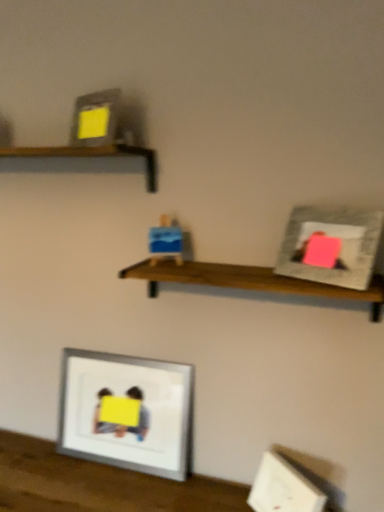
Describe the element at coordinates (166, 240) in the screenshot. I see `blue cardboard box at center` at that location.

Find the location of `wooden shelf at upper left, which appears as the 1th shelf when viewed from the left`. wooden shelf at upper left, which appears as the 1th shelf when viewed from the left is located at coordinates (91, 156).

This screenshot has width=384, height=512. What do you see at coordinates (331, 246) in the screenshot?
I see `matte gray picture frame at upper right, the 2th picture frame in the bottom-to-top sequence` at bounding box center [331, 246].

This screenshot has width=384, height=512. What do you see at coordinates (249, 281) in the screenshot?
I see `wooden shelf at center, which is the 2th shelf in top-to-bottom order` at bounding box center [249, 281].

At what (x,y) coordinates should I click in order to perform the action: click on wooden shelf at center, the first shelf positioned from the bottom. Please return your answer as a coordinate pair (x, y). Looking at the image, I should click on (249, 281).

Find the location of `blue cardboard box at center`. blue cardboard box at center is located at coordinates (166, 240).

Is wooden shelf at upper left, the first shelf viewed from the top, shorter than matte gray picture frame at upper right, the 2th picture frame when ordered from back to front?

Yes, wooden shelf at upper left, the first shelf viewed from the top, is shorter than matte gray picture frame at upper right, the 2th picture frame when ordered from back to front.

Can you confirm if wooden shelf at upper left, which appears as the 1th shelf when viewed from the left, is thinner than matte gray picture frame at upper right, the 2th picture frame in the bottom-to-top sequence?

In fact, wooden shelf at upper left, which appears as the 1th shelf when viewed from the left, might be wider than matte gray picture frame at upper right, the 2th picture frame in the bottom-to-top sequence.

Is wooden shelf at upper left, the first shelf viewed from the top, completely or partially outside of matte gray picture frame at upper right, placed as the 2th picture frame when sorted from left to right?

Yes, wooden shelf at upper left, the first shelf viewed from the top, is located beyond the bounds of matte gray picture frame at upper right, placed as the 2th picture frame when sorted from left to right.

Image resolution: width=384 pixels, height=512 pixels. I want to click on shelf that is on the right side of blue cardboard box at center, so click(249, 281).

Is wooden shelf at center, which is counted as the first shelf, starting from the right, wider or thinner than blue cardboard box at center?

Considering their sizes, wooden shelf at center, which is counted as the first shelf, starting from the right, looks broader than blue cardboard box at center.

Is blue cardboard box at center at the back of wooden shelf at center, which is counted as the first shelf, starting from the right?

No, blue cardboard box at center is not at the back of wooden shelf at center, which is counted as the first shelf, starting from the right.

Is wooden shelf at center, which is the 2th shelf in left-to-right order, not close to blue cardboard box at center?

wooden shelf at center, which is the 2th shelf in left-to-right order, is near blue cardboard box at center, not far away.

Can you tell me how much matte gray picture frame at upper right, placed as the 2th picture frame when sorted from left to right, and wooden shelf at upper left, arranged as the second shelf when ordered from the bottom, differ in facing direction?

28.3 degrees separate the facing orientations of matte gray picture frame at upper right, placed as the 2th picture frame when sorted from left to right, and wooden shelf at upper left, arranged as the second shelf when ordered from the bottom.

Considering the sizes of objects matte gray picture frame at upper right, which appears as the 1th picture frame when viewed from the right, and wooden shelf at upper left, which appears as the 1th shelf when viewed from the left, in the image provided, who is bigger, matte gray picture frame at upper right, which appears as the 1th picture frame when viewed from the right, or wooden shelf at upper left, which appears as the 1th shelf when viewed from the left,?

With larger size is wooden shelf at upper left, which appears as the 1th shelf when viewed from the left.

Is matte gray picture frame at upper right, which appears as the 1th picture frame when viewed from the right, directly adjacent to wooden shelf at upper left, arranged as the second shelf when ordered from the bottom?

No, matte gray picture frame at upper right, which appears as the 1th picture frame when viewed from the right, is not next to wooden shelf at upper left, arranged as the second shelf when ordered from the bottom.

Based on the photo, which of these two, wooden shelf at center, which is counted as the first shelf, starting from the right, or wooden shelf at upper left, arranged as the second shelf when ordered from the bottom, stands shorter?

wooden shelf at upper left, arranged as the second shelf when ordered from the bottom.

Considering the relative positions of wooden shelf at center, which is counted as the first shelf, starting from the right, and wooden shelf at upper left, positioned as the second shelf in right-to-left order, in the image provided, is wooden shelf at center, which is counted as the first shelf, starting from the right, to the right of wooden shelf at upper left, positioned as the second shelf in right-to-left order, from the viewer's perspective?

Yes, wooden shelf at center, which is counted as the first shelf, starting from the right, is to the right of wooden shelf at upper left, positioned as the second shelf in right-to-left order.

Based on the photo, are wooden shelf at center, the first shelf positioned from the bottom, and wooden shelf at upper left, the first shelf viewed from the top, far apart?

No, wooden shelf at center, the first shelf positioned from the bottom, is not far away from wooden shelf at upper left, the first shelf viewed from the top.

From a real-world perspective, is wooden shelf at center, which is the 2th shelf in left-to-right order, physically located above or below wooden shelf at upper left, the first shelf viewed from the top?

Clearly, from a real-world perspective, wooden shelf at center, which is the 2th shelf in left-to-right order, is below wooden shelf at upper left, the first shelf viewed from the top.

Does point (305, 220) lie in front of point (84, 366)?

Yes, point (305, 220) is in front of point (84, 366).

Is matte gray picture frame at upper right, arranged as the first picture frame when viewed from the top, not inside silver metallic picture frame at lower center, acting as the first picture frame starting from the left?

matte gray picture frame at upper right, arranged as the first picture frame when viewed from the top, lies outside silver metallic picture frame at lower center, acting as the first picture frame starting from the left,'s area.

This screenshot has width=384, height=512. I want to click on picture frame that appears behind the matte gray picture frame at upper right, placed as the 2th picture frame when sorted from left to right, so (127, 412).

Looking at this image, from a real-world perspective, is silver metallic picture frame at lower center, acting as the first picture frame starting from the left, located beneath matte gray picture frame at upper right, placed as the 2th picture frame when sorted from left to right?

Yes, from a real-world perspective, silver metallic picture frame at lower center, acting as the first picture frame starting from the left, is below matte gray picture frame at upper right, placed as the 2th picture frame when sorted from left to right.

What's the angular difference between silver metallic picture frame at lower center, placed as the second picture frame when sorted from front to back, and matte gray picture frame at upper right, the first picture frame from the front,'s facing directions?

The facing directions of silver metallic picture frame at lower center, placed as the second picture frame when sorted from front to back, and matte gray picture frame at upper right, the first picture frame from the front, are 28.7 degrees apart.

Considering the points (122, 359) and (293, 213), which point is in front, point (122, 359) or point (293, 213)?

Positioned in front is point (293, 213).

Is wooden shelf at center, which is the 2th shelf in top-to-bottom order, wider than silver metallic picture frame at lower center, which ranks as the second picture frame in right-to-left order?

Correct, the width of wooden shelf at center, which is the 2th shelf in top-to-bottom order, exceeds that of silver metallic picture frame at lower center, which ranks as the second picture frame in right-to-left order.

From the image's perspective, between wooden shelf at center, which is the 2th shelf in top-to-bottom order, and silver metallic picture frame at lower center, acting as the first picture frame starting from the left, which one is located above?

wooden shelf at center, which is the 2th shelf in top-to-bottom order.

Which point is more forward, [205,269] or [94,441]?

The point [205,269] is closer.

Relative to silver metallic picture frame at lower center, acting as the first picture frame starting from the left, is wooden shelf at center, which is the 2th shelf in left-to-right order, in front or behind?

wooden shelf at center, which is the 2th shelf in left-to-right order, is positioned closer to the viewer than silver metallic picture frame at lower center, acting as the first picture frame starting from the left.

You are a GUI agent. You are given a task and a screenshot of the screen. Output one action in this format:
    pyautogui.click(x=<x>, y=<y>)
    Task: Click on the shelf that is the 2nd one when counting leftward from the matte gray picture frame at upper right, which appears as the 1th picture frame when viewed from the right
    This screenshot has width=384, height=512.
    Given the screenshot: What is the action you would take?
    pyautogui.click(x=91, y=156)

The image size is (384, 512). In order to click on toy that is above the wooden shelf at center, which is the 2th shelf in left-to-right order (from a real-world perspective) in this screenshot , I will do `click(166, 240)`.

Estimate the real-world distances between objects in this image. Which object is closer to wooden shelf at upper left, which appears as the 1th shelf when viewed from the left, wooden shelf at center, which is the 2th shelf in left-to-right order, or matte gray picture frame at upper right, the 2th picture frame when ordered from back to front?

wooden shelf at center, which is the 2th shelf in left-to-right order, is positioned closer to the anchor wooden shelf at upper left, which appears as the 1th shelf when viewed from the left.

Looking at the image, which one is located closer to blue cardboard box at center, wooden shelf at center, which is the 2th shelf in left-to-right order, or wooden shelf at upper left, the first shelf viewed from the top?

Among the two, wooden shelf at center, which is the 2th shelf in left-to-right order, is located nearer to blue cardboard box at center.

From the image, which object appears to be farther from blue cardboard box at center, wooden shelf at upper left, which appears as the 1th shelf when viewed from the left, or wooden shelf at center, the first shelf positioned from the bottom?

Among the two, wooden shelf at upper left, which appears as the 1th shelf when viewed from the left, is located further to blue cardboard box at center.

In the scene shown: Looking at the image, which one is located further to silver metallic picture frame at lower center, acting as the 2th picture frame starting from the top, matte gray picture frame at upper right, which appears as the 1th picture frame when viewed from the right, or wooden shelf at center, which is the 2th shelf in left-to-right order?

Based on the image, matte gray picture frame at upper right, which appears as the 1th picture frame when viewed from the right, appears to be further to silver metallic picture frame at lower center, acting as the 2th picture frame starting from the top.

In the scene shown: Estimate the real-world distances between objects in this image. Which object is further from wooden shelf at center, which is the 2th shelf in top-to-bottom order, blue cardboard box at center or silver metallic picture frame at lower center, which appears as the 1th picture frame when viewed from the back?

silver metallic picture frame at lower center, which appears as the 1th picture frame when viewed from the back, is further to wooden shelf at center, which is the 2th shelf in top-to-bottom order.

Estimate the real-world distances between objects in this image. Which object is further from wooden shelf at center, the first shelf positioned from the bottom, silver metallic picture frame at lower center, which appears as the 1th picture frame when viewed from the back, or blue cardboard box at center?

silver metallic picture frame at lower center, which appears as the 1th picture frame when viewed from the back, is further to wooden shelf at center, the first shelf positioned from the bottom.

From the image, which object appears to be nearer to wooden shelf at upper left, which appears as the 1th shelf when viewed from the left, silver metallic picture frame at lower center, acting as the first picture frame starting from the left, or blue cardboard box at center?

blue cardboard box at center is positioned closer to the anchor wooden shelf at upper left, which appears as the 1th shelf when viewed from the left.

Based on their spatial positions, is blue cardboard box at center or wooden shelf at upper left, arranged as the second shelf when ordered from the bottom, further from wooden shelf at center, the first shelf positioned from the bottom?

wooden shelf at upper left, arranged as the second shelf when ordered from the bottom, is positioned further to the anchor wooden shelf at center, the first shelf positioned from the bottom.

Where is `toy located between wooden shelf at upper left, the first shelf viewed from the top, and matte gray picture frame at upper right, the 2th picture frame when ordered from back to front, in the left-right direction`? The width and height of the screenshot is (384, 512). toy located between wooden shelf at upper left, the first shelf viewed from the top, and matte gray picture frame at upper right, the 2th picture frame when ordered from back to front, in the left-right direction is located at coordinates (166, 240).

Find the location of a particular element. This screenshot has width=384, height=512. shelf between wooden shelf at upper left, which appears as the 1th shelf when viewed from the left, and matte gray picture frame at upper right, arranged as the first picture frame when viewed from the top, in the horizontal direction is located at coordinates (249, 281).

Locate an element on the screen. shelf located between silver metallic picture frame at lower center, acting as the first picture frame starting from the left, and matte gray picture frame at upper right, which appears as the 1th picture frame when viewed from the right, in the left-right direction is located at coordinates (249, 281).

Find the location of a particular element. The width and height of the screenshot is (384, 512). toy located between wooden shelf at upper left, which appears as the 1th shelf when viewed from the left, and wooden shelf at center, which is the 2th shelf in left-to-right order, in the left-right direction is located at coordinates (166, 240).